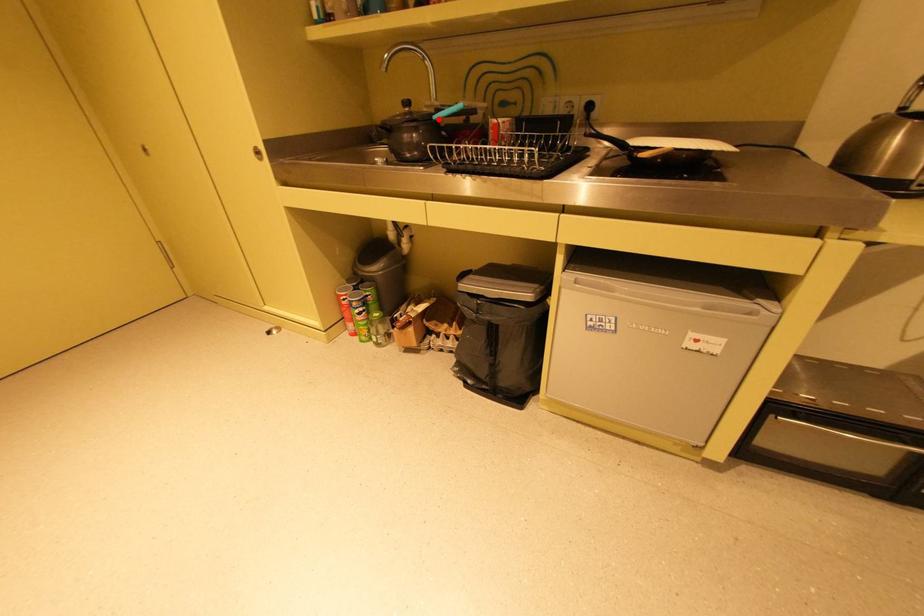
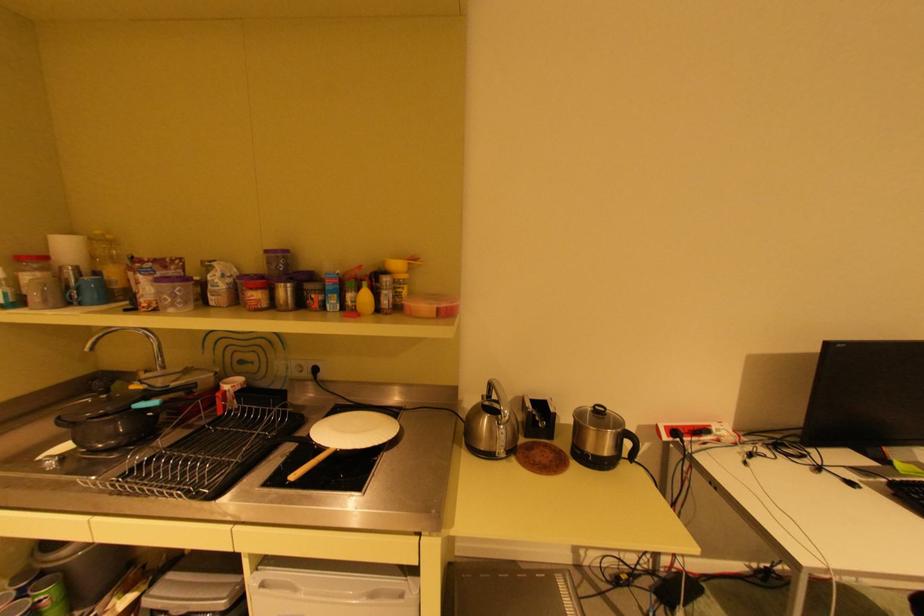
Find the pixel in the second image that matches the highlighted location in the first image.

(139, 408)